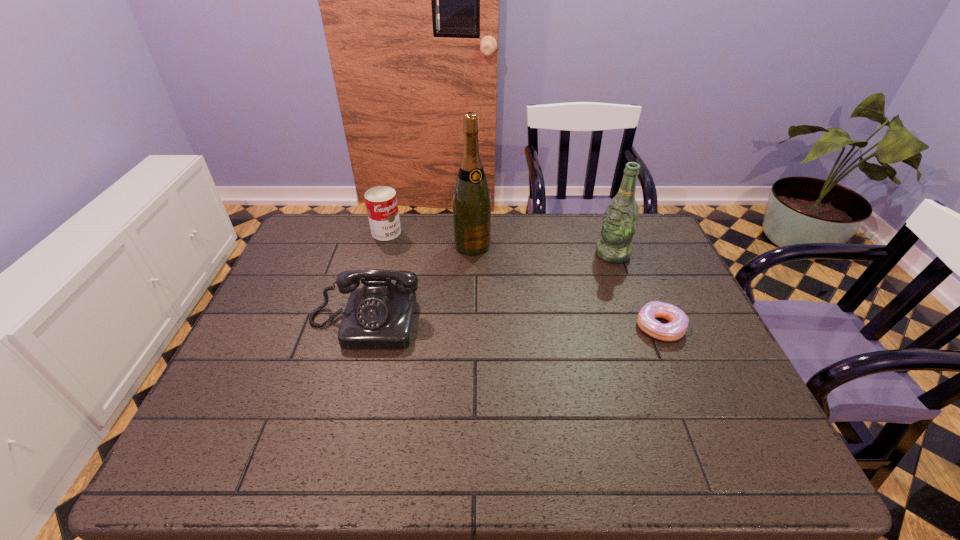
Identify the location of vacant space on the desktop that is between the telephone and the doughnut and is positioned on the surface of the fourth shortest object. This screenshot has width=960, height=540. (495, 325).

Find the location of `vacant spot on the desktop that is between the telephone and the shortest object and is positioned on the front label of the can`. vacant spot on the desktop that is between the telephone and the shortest object and is positioned on the front label of the can is located at coordinates (470, 324).

Locate an element on the screen. This screenshot has width=960, height=540. free spot on the desktop that is between the telephone and the shortest object and is positioned on the front-facing side of the third object from left to right is located at coordinates (529, 325).